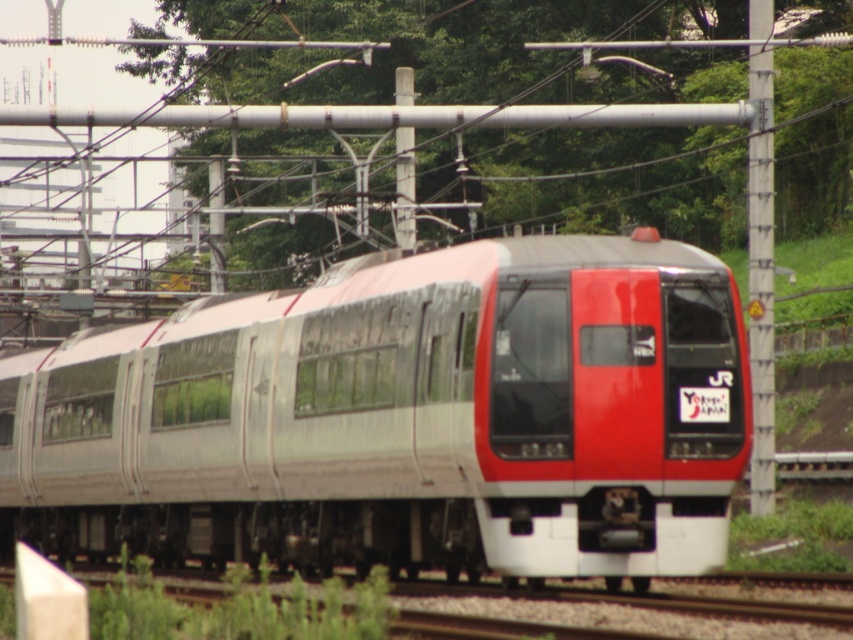
You are a photographer standing on the platform, and you want to capture the train passing by. You notice two metallic gray poles in your viewfinder. The metallic gray pole at right and the metallic gray pole at center. Which pole appears taller in the photo?

The metallic gray pole at right appears taller in the photo because it is much taller than the metallic gray pole at center.

You are a photographer standing at a platform trying to capture the silver metallic train at center and the metallic gray pole at center in a single photo. Given that the train is larger than the pole, how should you position your camera to ensure both are fully visible in the frame?

Since the silver metallic train at center is larger than the metallic gray pole at center, position your camera closer to the metallic gray pole at center so that the train takes up more space in the frame while still including the pole. This way, both objects will be fully visible without cropping either one.

You are standing at the point with coordinates (402, 419) in the image. What object are you directly facing?

The point at coordinates (402, 419) corresponds to the silver metallic train at center, so you are directly facing the silver metallic train at center.